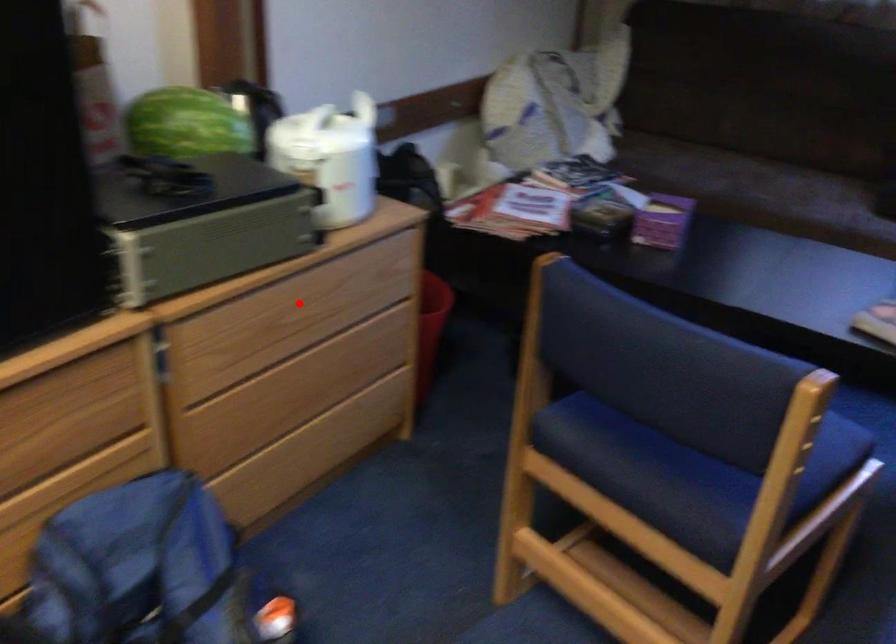
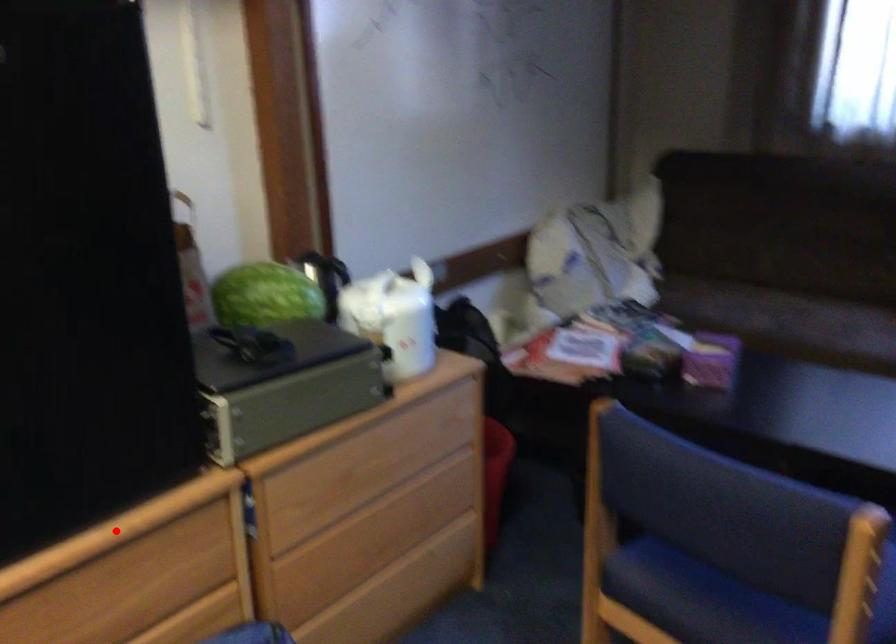
I am providing you with two images of the same scene from different viewpoints. A red point is marked on the first image and another point is marked on the second image. Is the marked point in image1 the same physical position as the marked point in image2?

No